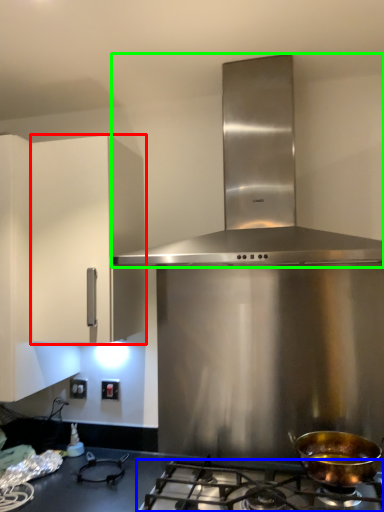
Question: Estimate the real-world distances between objects in this image. Which object is farther from cabinetry (highlighted by a red box), gas stove (highlighted by a blue box) or home appliance (highlighted by a green box)?

Choices:
 (A) gas stove
 (B) home appliance

Answer: (A)